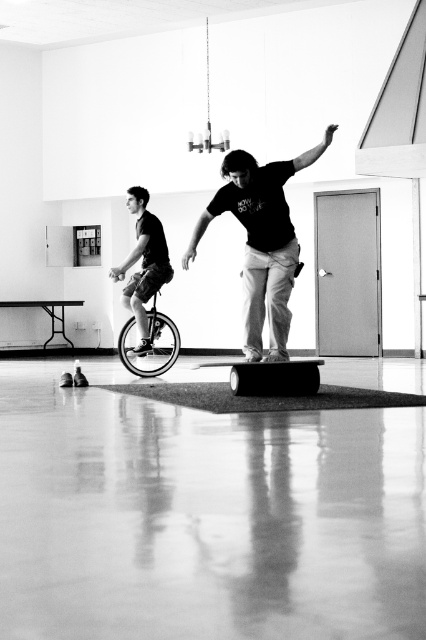
Which is in front, point (245, 205) or point (123, 353)?

Point (245, 205) is in front.

This screenshot has width=426, height=640. Identify the location of smooth wood skateboard at center. (261, 240).

Can you confirm if matte black unicycle at left is bigger than shiny metallic unicycle at center?

Yes.

Which is behind, point (155, 278) or point (154, 296)?

Point (154, 296)

You are a GUI agent. You are given a task and a screenshot of the screen. Output one action in this format:
    pyautogui.click(x=<x>, y=<y>)
    Task: Click on the matte black unicycle at left
    The width and height of the screenshot is (426, 640).
    Given the screenshot: What is the action you would take?
    pyautogui.click(x=143, y=262)

Consider the image. Does smooth wood skateboard at center have a greater width compared to smooth rubber skateboard at center?

Correct, the width of smooth wood skateboard at center exceeds that of smooth rubber skateboard at center.

Who is shorter, smooth wood skateboard at center or smooth rubber skateboard at center?

smooth rubber skateboard at center is shorter.

Does point (215, 204) lie in front of point (296, 380)?

Yes, point (215, 204) is in front of point (296, 380).

Locate an element on the screen. This screenshot has height=640, width=426. smooth wood skateboard at center is located at coordinates (261, 240).